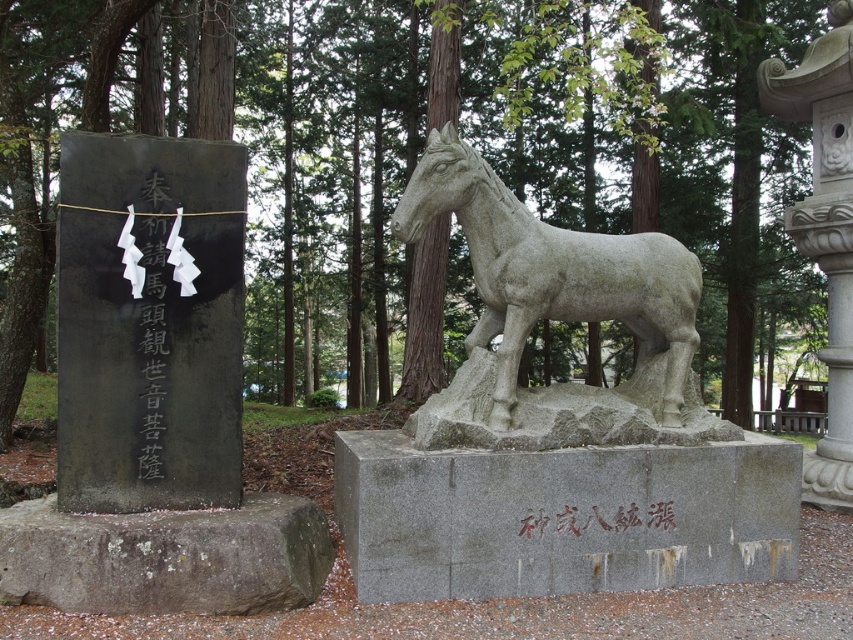
From the picture: You are a photographer planning to take a photo of the gray stone gravestone at lower left and the white stone lantern at upper right. Since you want both objects to appear balanced in the frame, which object should you place closer to the camera to achieve this?

The gray stone gravestone at lower left is bigger than the white stone lantern at upper right, so to balance them in the frame, you should place the white stone lantern at upper right closer to the camera.

You are standing in front of the two stone structures in the forest. There are two points marked in the image. Which point, point (x=509, y=477) or point (x=155, y=257), is closer to your eyes?

Point (x=509, y=477) is further to the camera than point (x=155, y=257), so the point closer to your eyes is point (x=155, y=257).

You are standing in a forest clearing and see the gray stone gravestone at lower left and the white stone lantern at upper right. Which object is positioned farther to the left in the scene?

The gray stone gravestone at lower left is positioned farther to the left compared to the white stone lantern at upper right.